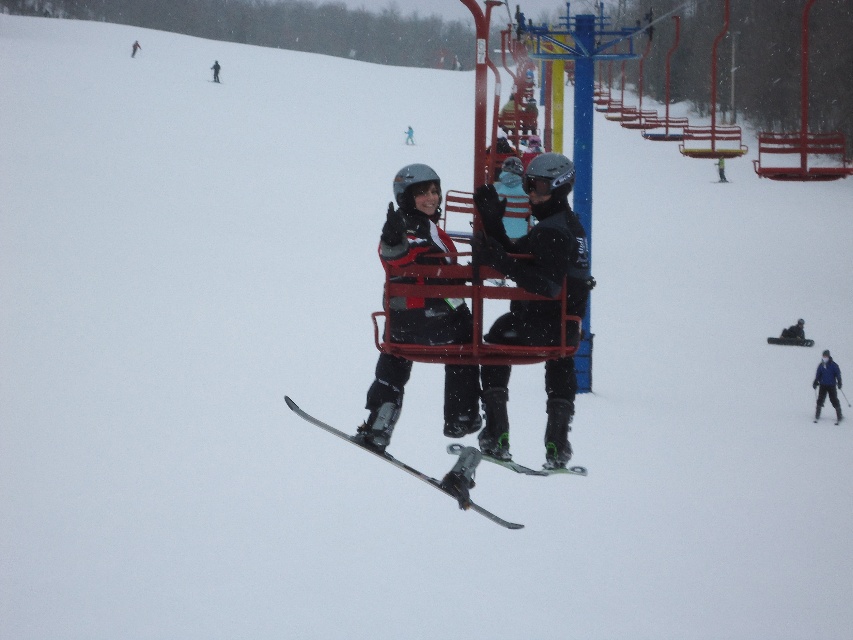
You are a photographer trying to capture a clear shot of the metallic silver ski at center and the black ski suit at center from the side. Which object would you need to focus on more carefully to avoid blurriness due to their size differences?

The metallic silver ski at center is thinner than the black ski suit at center, so you would need to focus more carefully on the metallic silver ski at center to avoid blurriness because it has a smaller size and might be harder to capture clearly.

You are a photographer trying to capture both the metallic silver ski at center and the black ski suit at center in a single frame. Since the camera has a limited focus range, which object should you prioritize focusing on to ensure it appears sharp given their size difference?

The metallic silver ski at center has a smaller size compared to black ski suit at center. Therefore, you should prioritize focusing on the metallic silver ski at center to ensure it appears sharp in the photo.

You are planning to take a photo of the metallic silver ski at center and the green fabric jacket at center. Which object should you focus on if you want to capture both in the frame without cropping?

You should focus on the green fabric jacket at center because the metallic silver ski at center occupies less space and will fit within the frame more easily.